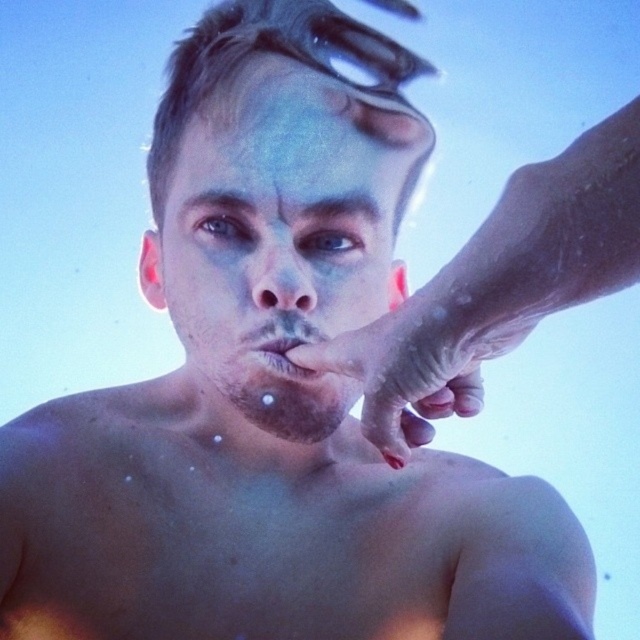
Based on the scene description, can the dry skin hand at center fit over the smooth skin nose at center?

The dry skin hand at center might be wider than smooth skin nose at center, so it could potentially cover it, but there is uncertainty due to the possible size difference.

You are a photographer taking a portrait of the individual in the scene. You notice the dry skin hand at center and the shiny metallic forehead at center. Which object should you adjust your focus on to ensure the hand is sharp while the forehead is slightly blurred?

You should focus on the dry skin hand at center, as it is in front of the shiny metallic forehead at center, so focusing on it will keep the hand sharp while the forehead may appear slightly blurred.

You are a lifeguard observing a swimmer in a pool. You notice the pale matte skin at center and the transparent plastic goggles at upper center. Which object takes up more space in the image?

The pale matte skin at center takes up more space in the image because it is bigger than the transparent plastic goggles at upper center.